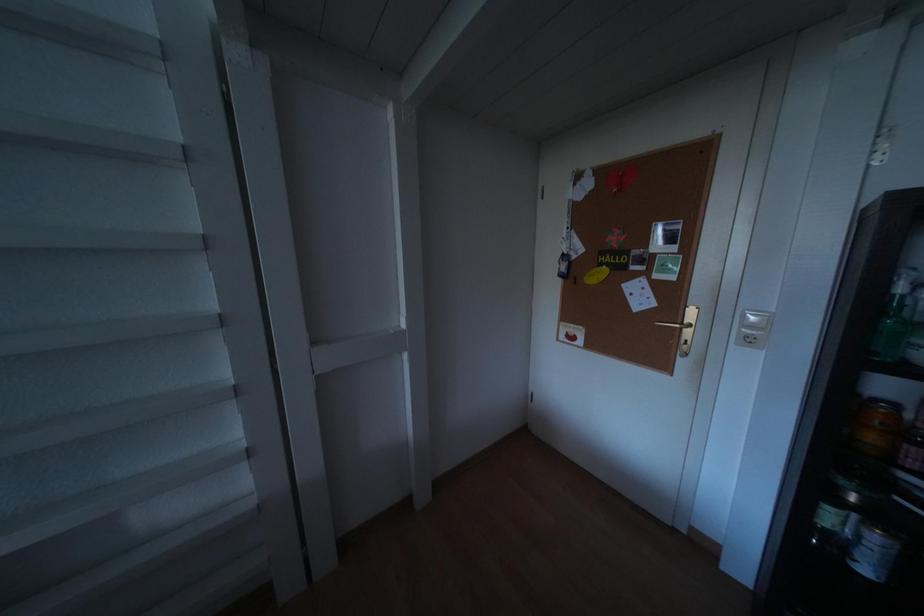
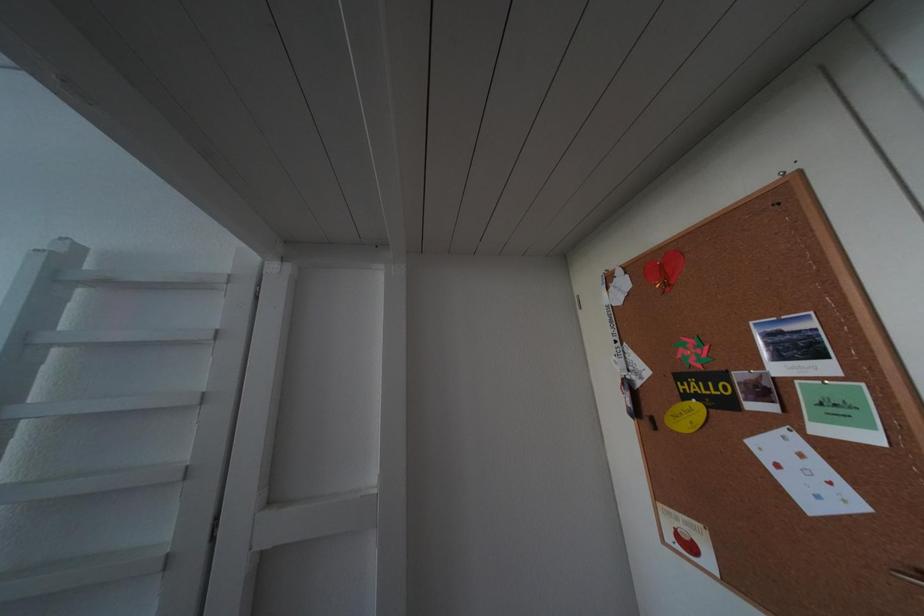
The first image is from the beginning of the video and the second image is from the end. How did the camera likely rotate when shooting the video?

The rotation direction of the camera is left-up.